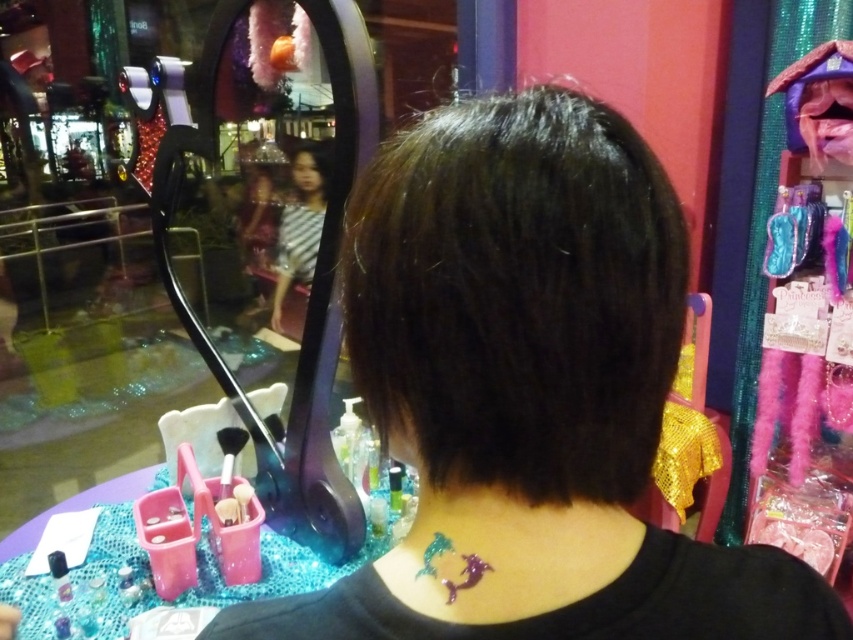
Question: Is shiny black hair at center to the right of metallic purple mermaid at center back from the viewer's perspective?

Choices:
 (A) yes
 (B) no

Answer: (A)

Question: Does shiny black hair at center have a larger size compared to metallic purple mermaid at center back?

Choices:
 (A) yes
 (B) no

Answer: (A)

Question: Does shiny glittery mermaid at center appear under metallic purple mermaid at center back?

Choices:
 (A) yes
 (B) no

Answer: (B)

Question: Which object appears farthest from the camera in this image?

Choices:
 (A) dark shiny hair at center
 (B) shiny black hair at center
 (C) metallic purple mermaid at center back
 (D) shiny glittery mermaid at center

Answer: (C)

Question: Which point is farther to the camera?

Choices:
 (A) (418, 344)
 (B) (434, 573)
 (C) (498, 614)

Answer: (B)

Question: Which object is the farthest from the shiny black hair at center?

Choices:
 (A) dark shiny hair at center
 (B) shiny glittery mermaid at center

Answer: (B)